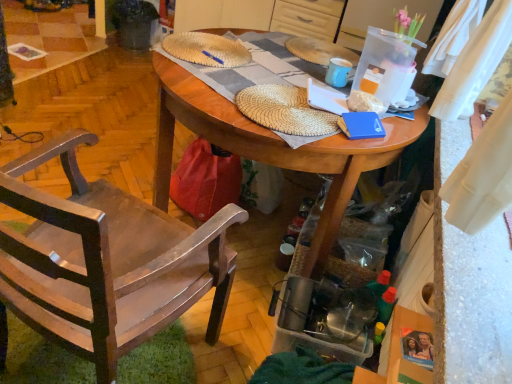
This screenshot has width=512, height=384. I want to click on free space in front of blue plastic pen at center, so click(205, 67).